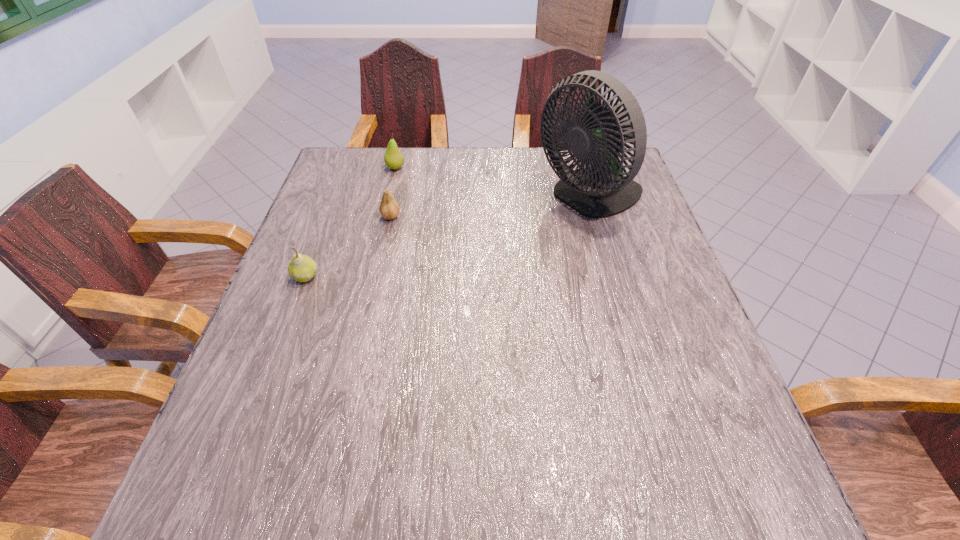
This screenshot has width=960, height=540. What are the coordinates of `vacant space situated on the back of the nearest object` in the screenshot? It's located at (323, 231).

Where is `vacant space located 0.240m on the right of the second nearest pear`? vacant space located 0.240m on the right of the second nearest pear is located at coordinates (492, 217).

At what (x,y) coordinates should I click in order to perform the action: click on fan positioned at the far edge. Please return your answer as a coordinate pair (x, y). The image size is (960, 540). Looking at the image, I should click on (599, 188).

Where is `pear present at the far edge`? Image resolution: width=960 pixels, height=540 pixels. pear present at the far edge is located at coordinates (393, 158).

This screenshot has height=540, width=960. I want to click on object positioned at the left edge, so click(302, 268).

Identify the location of object that is at the right edge. This screenshot has height=540, width=960. (599, 188).

The height and width of the screenshot is (540, 960). Find the location of `object at the far right corner`. object at the far right corner is located at coordinates (599, 188).

Image resolution: width=960 pixels, height=540 pixels. In the image, there is a desktop. Identify the location of vacant space at the far edge. (540, 158).

Locate an element on the screen. The image size is (960, 540). free space at the near edge of the desktop is located at coordinates (554, 504).

In the image, there is a desktop. Identify the location of vacant region at the left edge. The width and height of the screenshot is (960, 540). pyautogui.click(x=348, y=273).